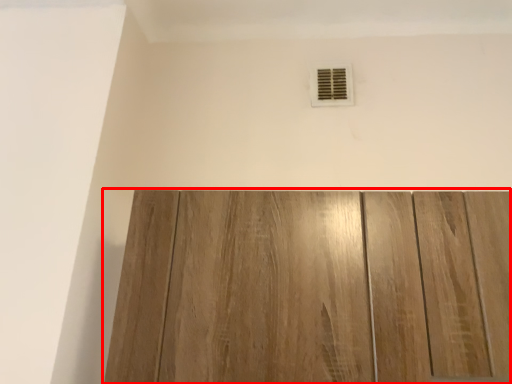
Question: From the image's perspective, what is the correct spatial relationship of door (annotated by the red box) in relation to air conditioning?

Choices:
 (A) below
 (B) above

Answer: (A)